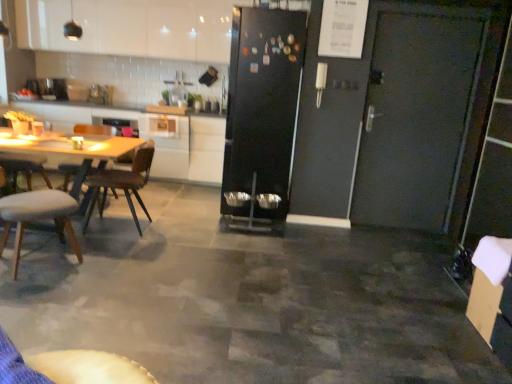
Question: Considering the positions of black matte refrigerator at center and brown wooden chair at left, the 2th chair when ordered from front to back, in the image, is black matte refrigerator at center taller or shorter than brown wooden chair at left, the 2th chair when ordered from front to back,?

Choices:
 (A) short
 (B) tall

Answer: (B)

Question: Based on their positions, is black matte refrigerator at center located to the left or right of brown wooden chair at left, the 2th chair when ordered from front to back?

Choices:
 (A) left
 (B) right

Answer: (B)

Question: Estimate the real-world distances between objects in this image. Which object is farther from the white leather chair at left, the second chair in the back-to-front sequence?

Choices:
 (A) white glossy cabinet at upper left, which is counted as the second cabinetry, starting from the bottom
 (B) white glossy cabinet at center, which is the 2th cabinetry in top-to-bottom order
 (C) brown wooden chair at left, the 2th chair when ordered from front to back
 (D) white glossy countertop at upper left
 (E) black matte refrigerator at center

Answer: (A)

Question: Which of these objects is positioned closest to the white leather chair at left, which ranks as the first chair in front-to-back order?

Choices:
 (A) white glossy countertop at upper left
 (B) white glossy cabinet at center, which is the 2th cabinetry in top-to-bottom order
 (C) brown wooden chair at left, the 2th chair when ordered from front to back
 (D) black matte refrigerator at center
 (E) white glossy cabinet at upper left, which is counted as the second cabinetry, starting from the bottom

Answer: (C)